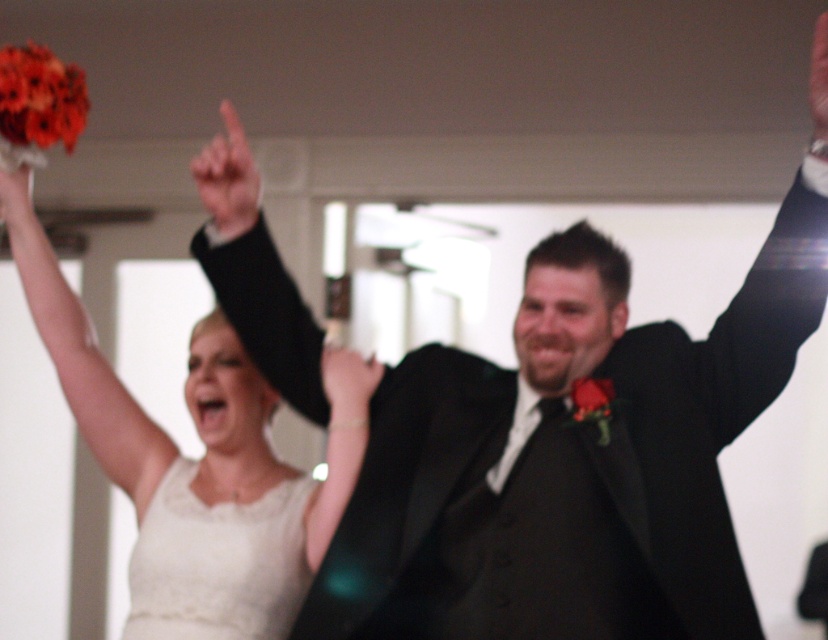
Which is in front, point (720, 323) or point (289, 333)?

Point (720, 323)

Which is more to the left, black fabric arm at upper right or black satin suit at upper center?

Positioned to the left is black satin suit at upper center.

Identify the location of black fabric arm at upper right. This screenshot has width=828, height=640. (768, 316).

From the picture: Who is shorter, white matte arm at upper left or matte black hand at center?

Standing shorter between the two is matte black hand at center.

Describe the element at coordinates (82, 356) in the screenshot. I see `white matte arm at upper left` at that location.

Locate an element on the screen. white matte arm at upper left is located at coordinates click(82, 356).

Between black fabric arm at upper right and white satin bouquet at upper left, which one is positioned lower?

Positioned lower is black fabric arm at upper right.

Can you confirm if black fabric arm at upper right is smaller than white satin bouquet at upper left?

Incorrect, black fabric arm at upper right is not smaller in size than white satin bouquet at upper left.

Is point (777, 320) farther from camera compared to point (30, 163)?

No, it is in front of (30, 163).

Locate an element on the screen. black fabric arm at upper right is located at coordinates (768, 316).